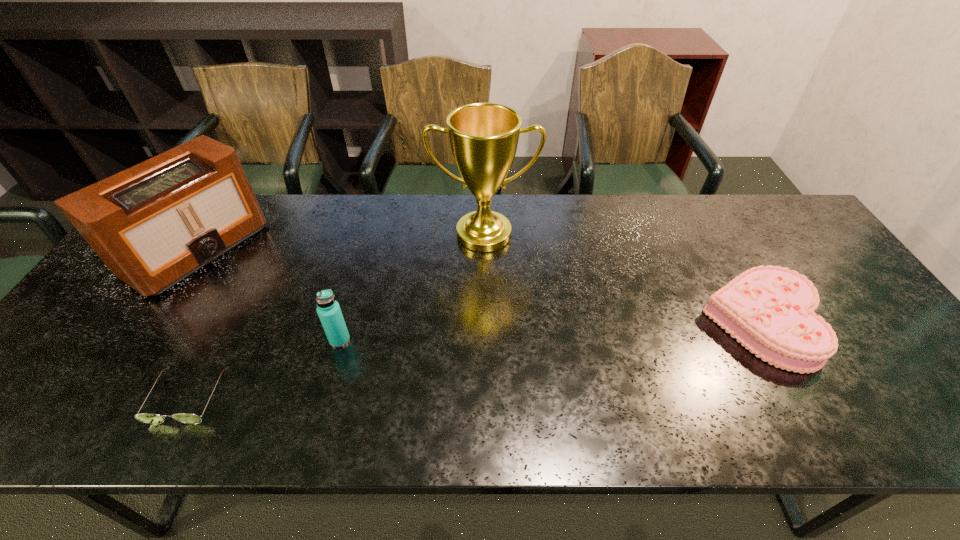
Where is `vacant space at the right edge of the desktop`? vacant space at the right edge of the desktop is located at coordinates (916, 380).

Locate an element on the screen. Image resolution: width=960 pixels, height=540 pixels. vacant area at the far right corner is located at coordinates (733, 198).

Image resolution: width=960 pixels, height=540 pixels. What are the coordinates of `free area in between the third object from left to right and the rightmost object` in the screenshot? It's located at (551, 332).

The height and width of the screenshot is (540, 960). Find the location of `empty space that is in between the second tallest object and the rightmost object`. empty space that is in between the second tallest object and the rightmost object is located at coordinates (480, 286).

The image size is (960, 540). Identify the location of unoccupied area between the rightmost object and the third object from left to right. (551, 332).

The image size is (960, 540). In order to click on free spot between the shortest object and the fourth shortest object in this screenshot , I will do `click(193, 322)`.

I want to click on free space between the sunglasses and the third shortest object, so click(x=264, y=368).

Locate an element on the screen. The image size is (960, 540). free space that is in between the fourth tallest object and the radio receiver is located at coordinates (480, 286).

You are a GUI agent. You are given a task and a screenshot of the screen. Output one action in this format:
    pyautogui.click(x=<x>, y=<y>)
    Task: Click on the free spot between the fourth shortest object and the water bottle
    This screenshot has height=540, width=960.
    Given the screenshot: What is the action you would take?
    pyautogui.click(x=269, y=294)

The image size is (960, 540). In order to click on vacant point located between the third shortest object and the sunglasses in this screenshot , I will do `click(264, 368)`.